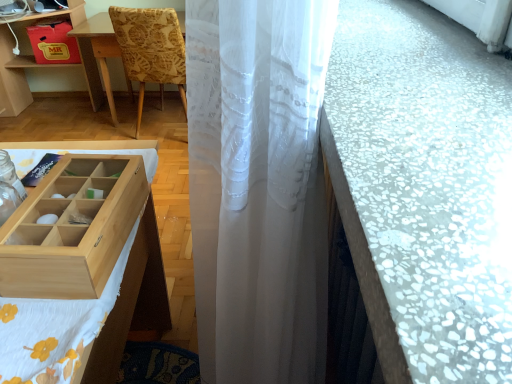
Question: Considering the relative sizes of matte cardboard drawer at upper left and wooden table at left in the image provided, is matte cardboard drawer at upper left wider than wooden table at left?

Choices:
 (A) no
 (B) yes

Answer: (A)

Question: Is there a large distance between matte cardboard drawer at upper left and wooden table at left?

Choices:
 (A) no
 (B) yes

Answer: (A)

Question: Can you confirm if matte cardboard drawer at upper left is shorter than wooden table at left?

Choices:
 (A) no
 (B) yes

Answer: (B)

Question: Is matte cardboard drawer at upper left not inside wooden table at left?

Choices:
 (A) yes
 (B) no

Answer: (B)

Question: Is matte cardboard drawer at upper left to the right of wooden table at left from the viewer's perspective?

Choices:
 (A) no
 (B) yes

Answer: (B)

Question: Is the depth of matte cardboard drawer at upper left greater than that of wooden table at left?

Choices:
 (A) no
 (B) yes

Answer: (B)

Question: Does white fabric at left have a lesser width compared to light wood/wooden box at lower left?

Choices:
 (A) no
 (B) yes

Answer: (A)

Question: Is white fabric at left completely or partially outside of light wood/wooden box at lower left?

Choices:
 (A) no
 (B) yes

Answer: (B)

Question: Considering the relative sizes of white fabric at left and light wood/wooden box at lower left in the image provided, is white fabric at left shorter than light wood/wooden box at lower left?

Choices:
 (A) yes
 (B) no

Answer: (B)

Question: Does white fabric at left appear on the left side of light wood/wooden box at lower left?

Choices:
 (A) no
 (B) yes

Answer: (B)

Question: Is white fabric at left not close to light wood/wooden box at lower left?

Choices:
 (A) yes
 (B) no

Answer: (B)

Question: Is white fabric at left turned away from light wood/wooden box at lower left?

Choices:
 (A) no
 (B) yes

Answer: (A)

Question: From a real-world perspective, does white mosaic tile counter top at right stand above white sheer curtain at center?

Choices:
 (A) yes
 (B) no

Answer: (A)